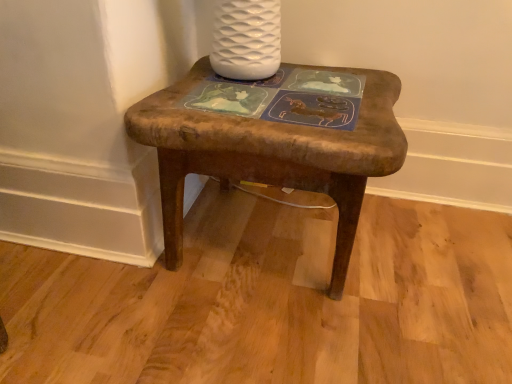
Find the location of a particular element. The height and width of the screenshot is (384, 512). vacant region above rustic wood stool at center (from a real-world perspective) is located at coordinates (x=275, y=97).